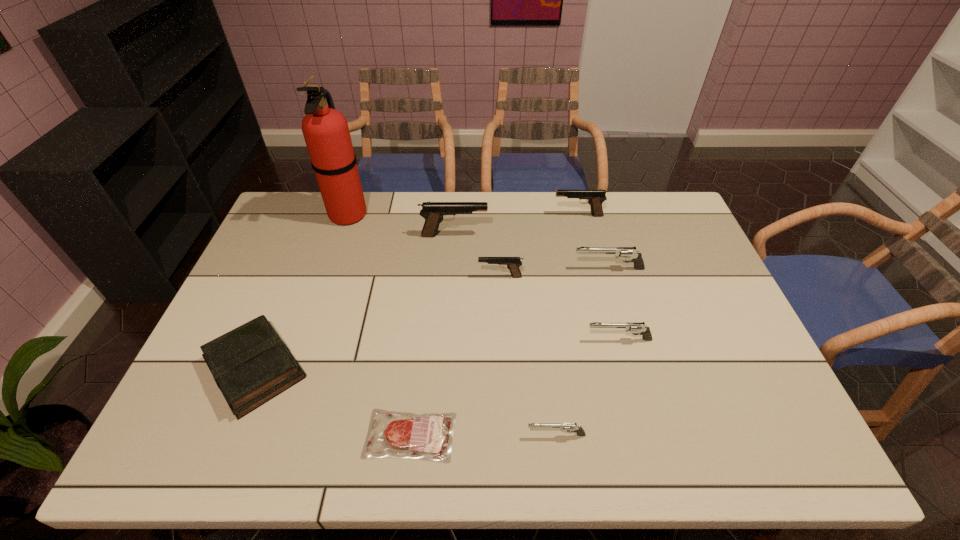
Image resolution: width=960 pixels, height=540 pixels. I want to click on vacant space located at the muzzle of the fifth shortest pistol, so click(x=494, y=215).

Find the location of a particular element. free space located on the front-facing side of the fourth nearest pistol is located at coordinates (522, 268).

Locate an element on the screen. This screenshot has height=540, width=960. vacant space positioned on the front-facing side of the fourth nearest pistol is located at coordinates (474, 268).

Find the location of a particular element. This screenshot has width=960, height=540. vacant space located on the front-facing side of the fourth nearest pistol is located at coordinates (455, 268).

Identify the location of vacant space located 0.260m at the muzzle of the nearest black pistol. The image size is (960, 540). (394, 276).

Identify the location of vacant position located at the muzzle of the nearest black pistol. (410, 276).

Find the location of `free space located at the muzzle of the nearest black pistol`. free space located at the muzzle of the nearest black pistol is located at coordinates (352, 276).

Where is `vacant space located on the front-facing side of the second biggest silver pistol`? This screenshot has height=540, width=960. vacant space located on the front-facing side of the second biggest silver pistol is located at coordinates tap(449, 340).

At what (x,y) coordinates should I click in order to perform the action: click on free space located on the front-facing side of the second biggest silver pistol. Please return your answer as a coordinate pair (x, y). Looking at the image, I should click on (465, 340).

Identify the location of vacant space positioned on the front-facing side of the second biggest silver pistol. This screenshot has width=960, height=540. (545, 340).